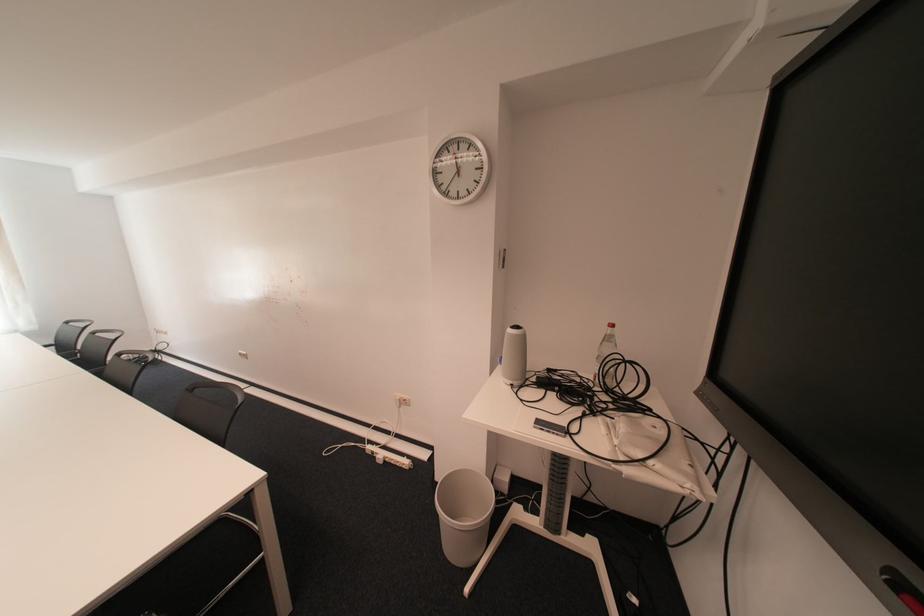
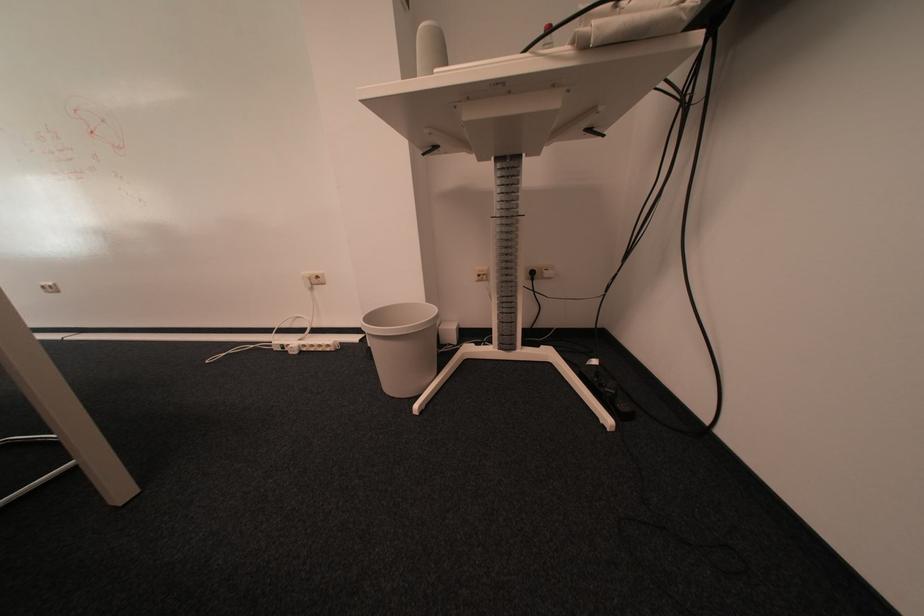
Question: The images are taken continuously from a first-person perspective. In which direction is your viewpoint rotating?

Choices:
 (A) Left
 (B) Right
 (C) Up
 (D) Down

Answer: (B)